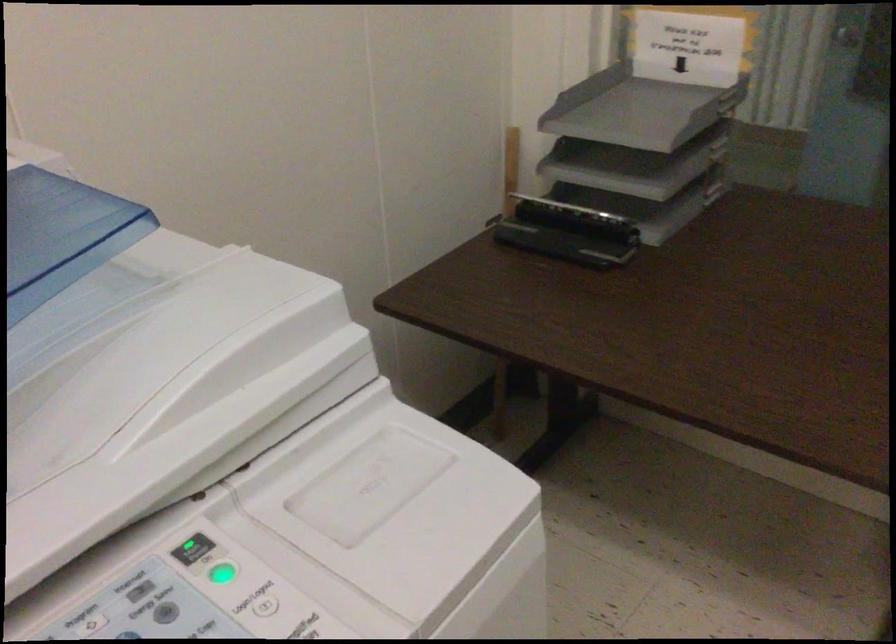
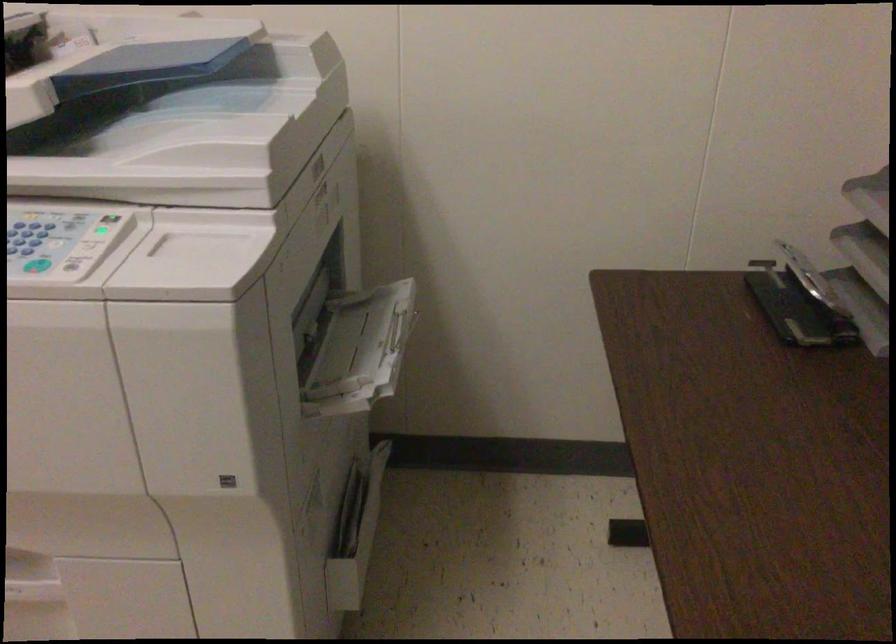
Where in the second image is the point corresponding to point (202, 567) from the first image?

(107, 228)